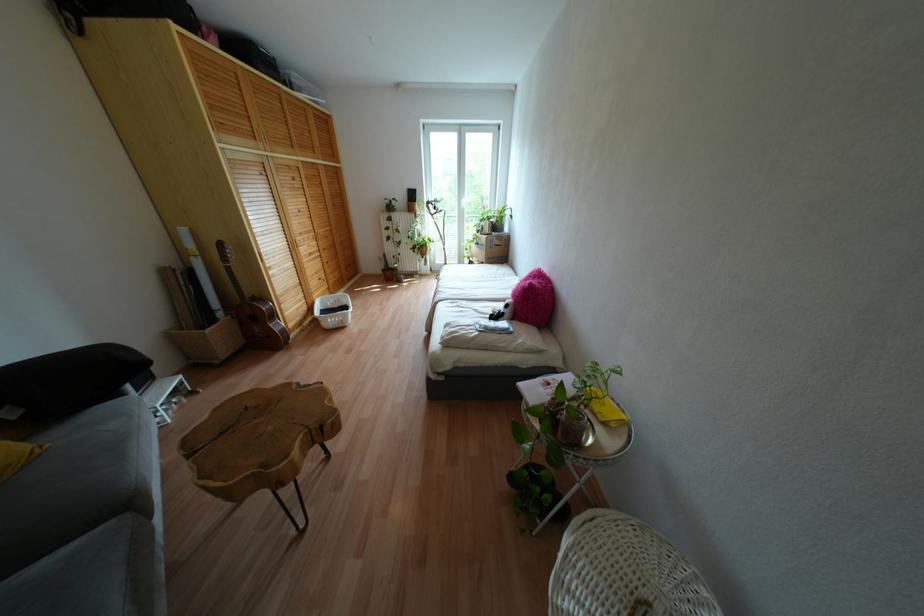
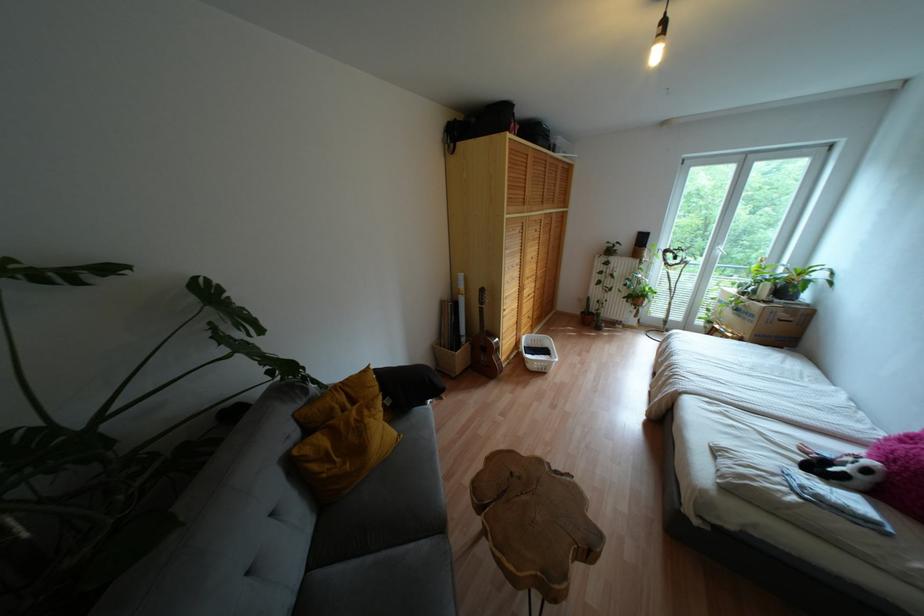
Find the pixel in the second image that matches point (505, 305) in the first image.

(867, 471)